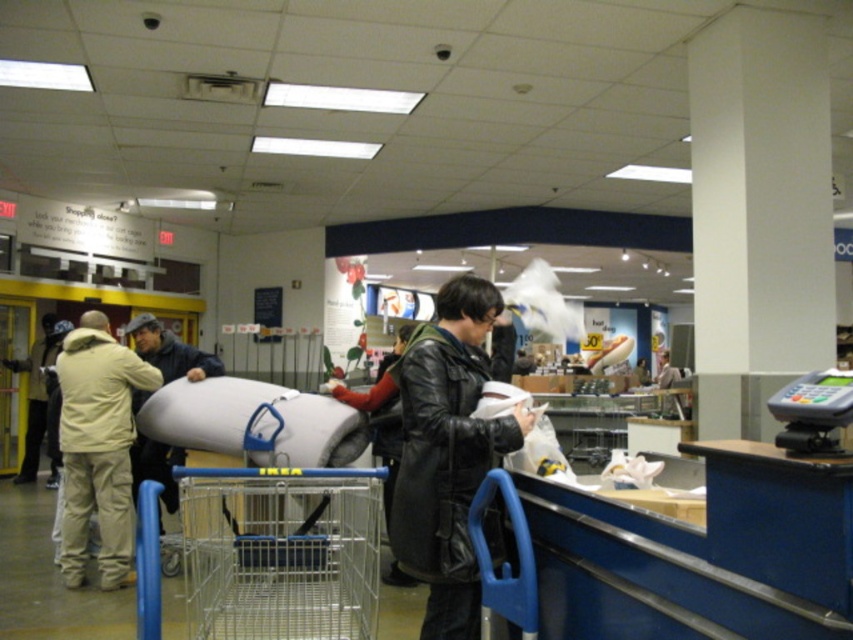
Question: Which point appears closest to the camera in this image?

Choices:
 (A) (152, 317)
 (B) (422, 636)
 (C) (61, 355)

Answer: (B)

Question: Is the position of blue metal shopping cart at lower center less distant than that of black leather jacket at center?

Choices:
 (A) yes
 (B) no

Answer: (A)

Question: Is blue metal shopping cart at lower center below black leather jacket at center?

Choices:
 (A) no
 (B) yes

Answer: (B)

Question: Which point is closer to the camera?

Choices:
 (A) click(x=155, y=552)
 (B) click(x=181, y=356)

Answer: (A)

Question: Which point is farther from the camera taking this photo?

Choices:
 (A) click(201, 358)
 (B) click(486, 432)
 (C) click(44, 368)

Answer: (C)

Question: Can you confirm if beige fabric jacket at left is positioned below dark blue jacket at center?

Choices:
 (A) no
 (B) yes

Answer: (B)